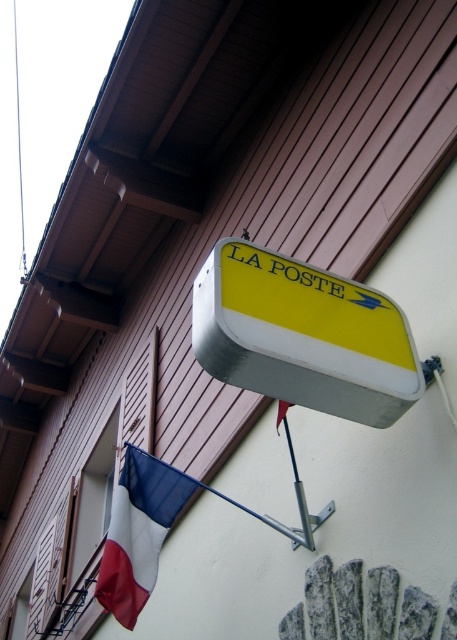
Can you confirm if yellow matte sign at upper center is taller than tricolor fabric flag at lower left?

No, yellow matte sign at upper center is not taller than tricolor fabric flag at lower left.

Which is above, yellow matte sign at upper center or tricolor fabric flag at lower left?

yellow matte sign at upper center

Identify the location of yellow matte sign at upper center. The image size is (457, 640). (302, 336).

Identify the location of yellow matte sign at upper center. (302, 336).